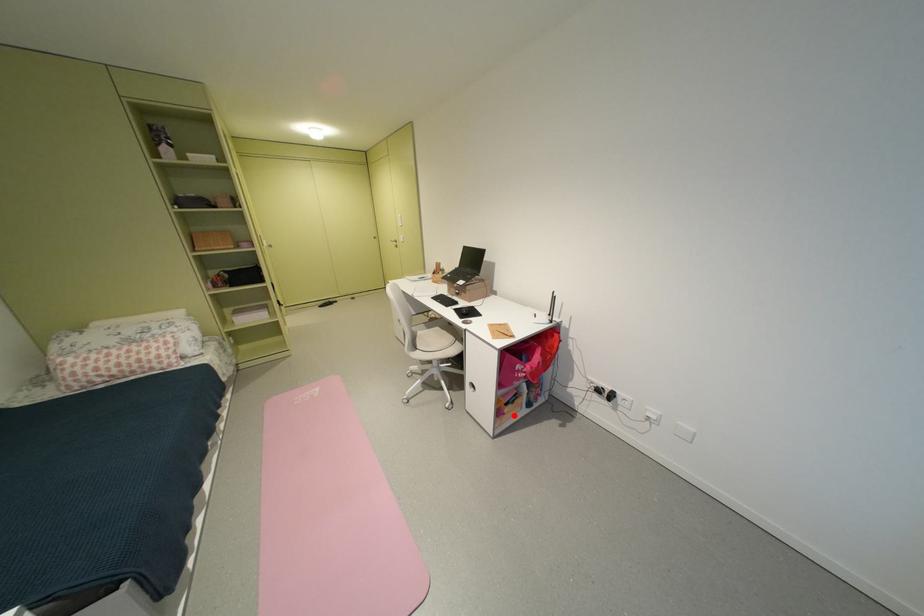
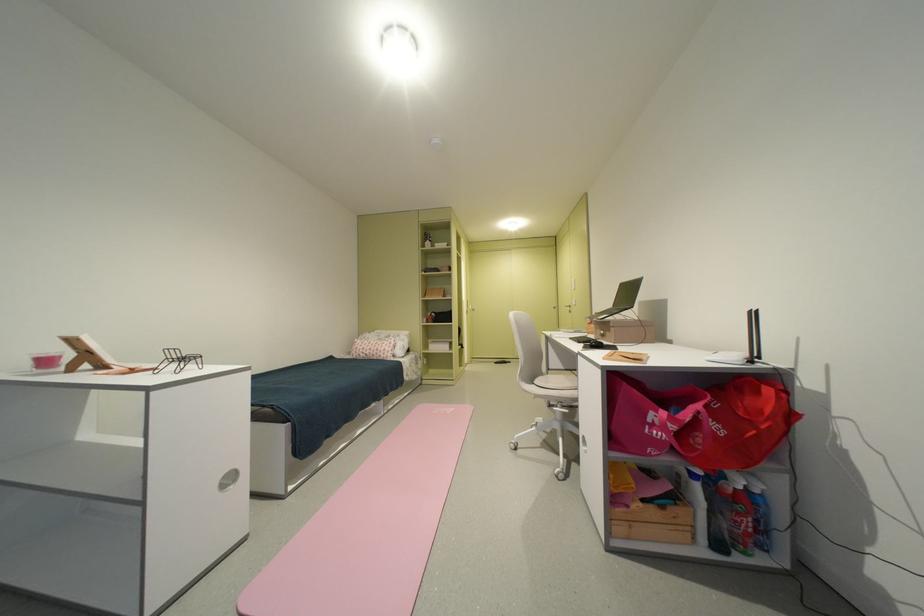
Find the pixel in the second image that matches the highlighted location in the first image.

(638, 508)